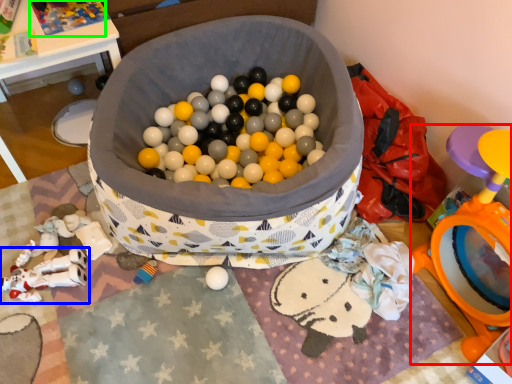
Question: Which object is the closest to the toy (highlighted by a red box)? Choose among these: toy (highlighted by a blue box) or toy (highlighted by a green box).

Choices:
 (A) toy
 (B) toy

Answer: (A)